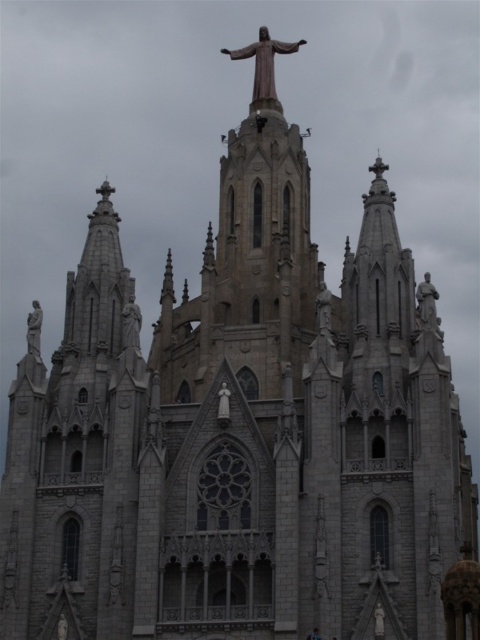
You are an art student analyzing the Gothic church facade. You observe two statues at the center of the church. Which statue, the gray stone statue at center or the polished stone statue at center, is positioned higher up?

The polished stone statue at center is positioned higher up because it is taller than the gray stone statue at center.

You are standing in front of the grand Gothic church and notice two points marked on the facade. The first point is located at coordinates point (39, 342) and the second at point (327, 289). From your perspective, which point is closer to you?

Point (327, 289) is closer to you because the description states that point (39, 342) is behind point (327, 289).

You are an art student analyzing the Gothic church facade. The scene includes a gray stone statue at left and a gray stone statue at center. Which statue is larger in size?

The gray stone statue at left is bigger than the gray stone statue at center.